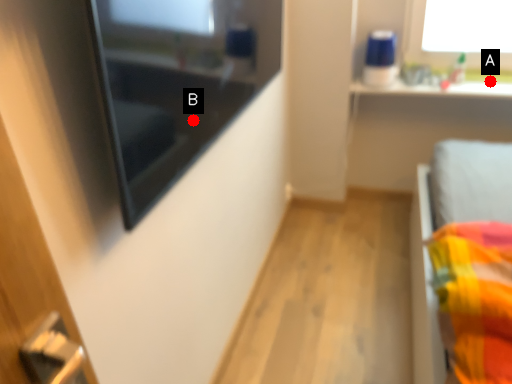
Question: Two points are circled on the image, labeled by A and B beside each circle. Which of the following is the closest to the observer?

Choices:
 (A) A is closer
 (B) B is closer

Answer: (B)